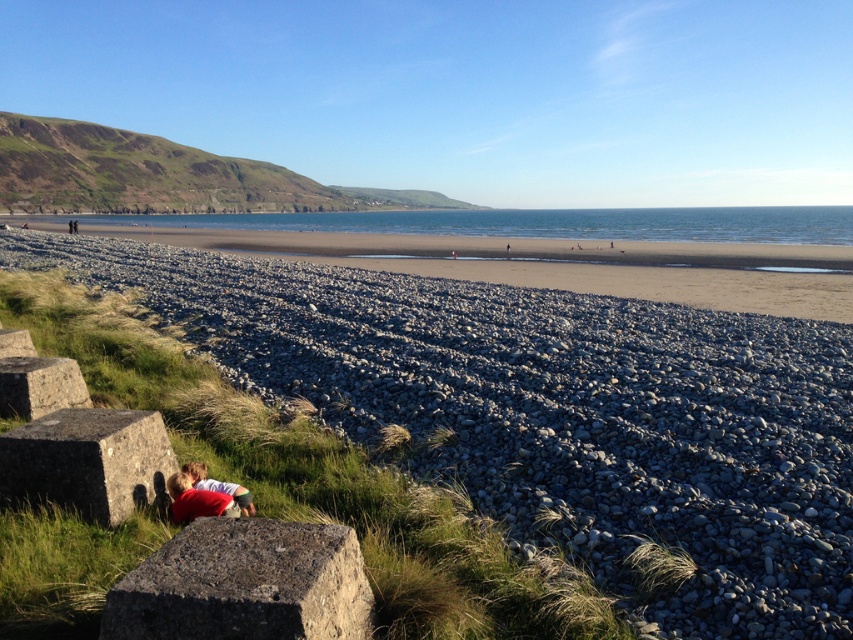
Does smooth pebbles at center come in front of gray gravel beach at center?

Yes, smooth pebbles at center is in front of gray gravel beach at center.

From the picture: Who is more forward, [828,518] or [759,259]?

Point [828,518]

Find the location of a particular element. Image resolution: width=853 pixels, height=640 pixels. smooth pebbles at center is located at coordinates (550, 410).

Which of these two, gray stone at lower left or gray rough stone at lower left, stands taller?

gray stone at lower left

Describe the element at coordinates (86, 460) in the screenshot. The width and height of the screenshot is (853, 640). I see `gray stone at lower left` at that location.

Locate an element on the screen. gray stone at lower left is located at coordinates (86, 460).

Between red fabric person at lower left and smooth gray rock at lower left, which one appears on the left side from the viewer's perspective?

From the viewer's perspective, smooth gray rock at lower left appears more on the left side.

In the scene shown: Can you confirm if red fabric person at lower left is positioned to the right of smooth gray rock at lower left?

Indeed, red fabric person at lower left is positioned on the right side of smooth gray rock at lower left.

Does point (206, 484) come behind point (1, 346)?

No.

Locate an element on the screen. The height and width of the screenshot is (640, 853). red fabric person at lower left is located at coordinates (219, 486).